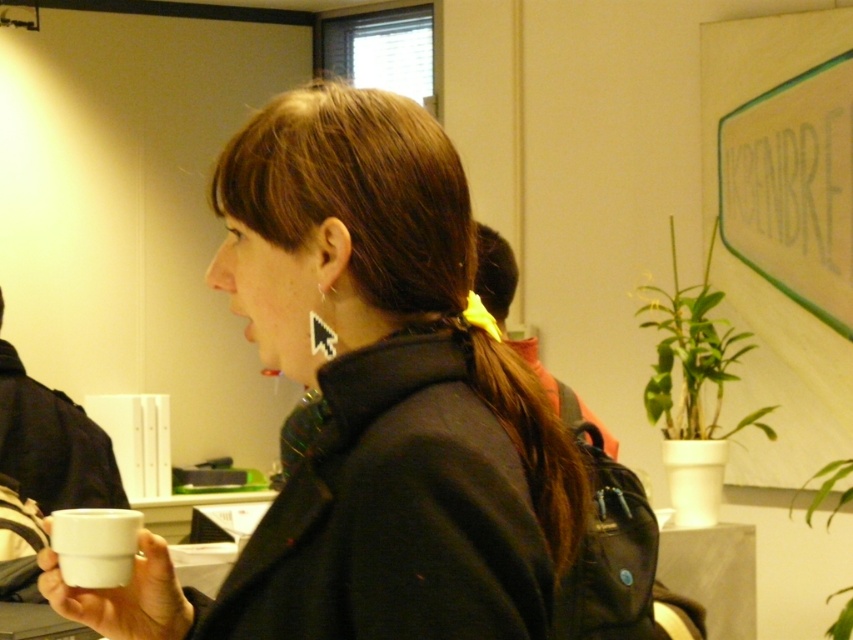
Question: Which object appears closest to the camera in this image?

Choices:
 (A) white matte mug at lower left
 (B) white matte cup at center

Answer: (B)

Question: Which of the following is the farthest from the observer?

Choices:
 (A) (322, 120)
 (B) (125, 518)

Answer: (B)

Question: Observing the image, what is the correct spatial positioning of white matte cup at center in reference to white matte mug at lower left?

Choices:
 (A) above
 (B) below

Answer: (A)

Question: Does white matte cup at center have a greater width compared to white matte mug at lower left?

Choices:
 (A) yes
 (B) no

Answer: (A)

Question: Is white matte cup at center bigger than white matte mug at lower left?

Choices:
 (A) yes
 (B) no

Answer: (A)

Question: Which of the following is the closest to the observer?

Choices:
 (A) (328, 308)
 (B) (80, 586)

Answer: (A)